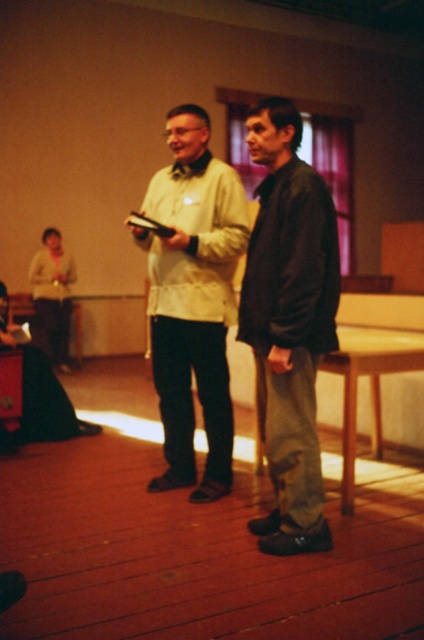
You are a tailor measuring jackets for alterations. You need to determine if there is enough space between the dark brown leather jacket at center and the matte beige jacket at center to place a 50 cm long measuring tape between them. Can you fit the tape?

The dark brown leather jacket at center and matte beige jacket at center are 49.70 centimeters apart from each other. Since the measuring tape is 50 cm long, it cannot fit entirely between them as the space is slightly less than required.

You are an assistant helping to organize a clothing store. You have two jackets in front of you, the dark brown leather jacket at center and the matte beige jacket at center. Which jacket is narrower in width?

The dark brown leather jacket at center is thinner than the matte beige jacket at center, so it is narrower in width.

You are standing in the room and want to hand a document to the person wearing the matte beige jacket at center without approaching the dark brown leather jacket at center. Is this possible based on their positions?

The dark brown leather jacket at center is closer to the viewer than the matte beige jacket at center, so you can reach the matte beige jacket at center without moving the dark brown leather jacket at center as they are positioned at different depths.